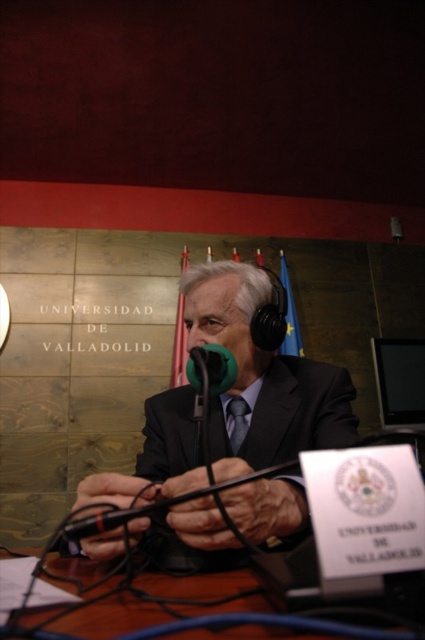
You are a photographer standing 10 feet away from the scene. You want to take a picture of the matte black suit at center and the wooden table at center. Can you fit both objects into your camera frame if the maximum width your camera can capture is 10 inches?

The matte black suit at center and wooden table at center are 8.22 inches apart, so yes, both objects can fit into the camera frame since the distance between them is within the 10 inches maximum width the camera can capture.

You are organizing a small event and need to place a 1.2 meter wide banner behind the matte black suit at center. The banner requires 1.5 meters of space to be displayed properly. Can the wooden table at center be moved to accommodate this requirement?

The matte black suit at center might be wider than wooden table at center, so moving the wooden table at center may not provide enough space for the 1.5 meter banner. Check the actual dimensions before deciding.

You are a fashion designer observing a man dressed in a matte black suit at center and a matte black tie at center. Which item has a greater width?

The matte black suit at center has a greater width than the matte black tie at center.